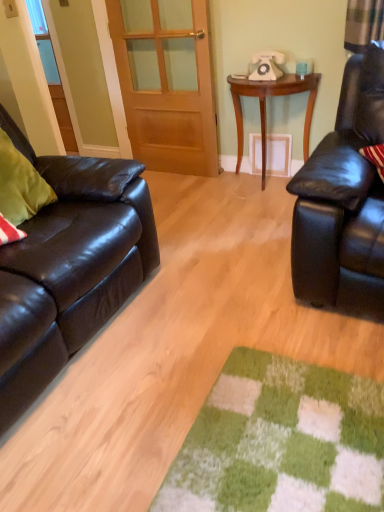
Question: Would you say wooden table at center is outside matte black leather couch at left?

Choices:
 (A) no
 (B) yes

Answer: (B)

Question: Is wooden table at center surrounding matte black leather couch at left?

Choices:
 (A) yes
 (B) no

Answer: (B)

Question: From a real-world perspective, is wooden table at center located beneath matte black leather couch at left?

Choices:
 (A) no
 (B) yes

Answer: (A)

Question: Considering the relative sizes of wooden table at center and matte black leather couch at left in the image provided, is wooden table at center smaller than matte black leather couch at left?

Choices:
 (A) no
 (B) yes

Answer: (B)

Question: Is wooden table at center bigger than matte black leather couch at left?

Choices:
 (A) yes
 (B) no

Answer: (B)

Question: Considering their positions, is white plastic telephone at upper center located in front of or behind shiny black leather couch at left?

Choices:
 (A) front
 (B) behind

Answer: (B)

Question: Is point (256, 56) closer or farther from the camera than point (74, 232)?

Choices:
 (A) farther
 (B) closer

Answer: (A)

Question: Considering the positions of white plastic telephone at upper center and shiny black leather couch at left in the image, is white plastic telephone at upper center taller or shorter than shiny black leather couch at left?

Choices:
 (A) tall
 (B) short

Answer: (B)

Question: Visually, is white plastic telephone at upper center positioned to the left or to the right of shiny black leather couch at left?

Choices:
 (A) left
 (B) right

Answer: (B)

Question: Is point (203, 54) closer or farther from the camera than point (269, 71)?

Choices:
 (A) farther
 (B) closer

Answer: (A)

Question: Considering the positions of wooden door at center and white plastic telephone at upper center in the image, is wooden door at center wider or thinner than white plastic telephone at upper center?

Choices:
 (A) thin
 (B) wide

Answer: (A)

Question: From a real-world perspective, is wooden door at center above or below white plastic telephone at upper center?

Choices:
 (A) above
 (B) below

Answer: (B)

Question: Relative to white plastic telephone at upper center, is wooden door at center in front or behind?

Choices:
 (A) behind
 (B) front

Answer: (A)

Question: Relative to wooden door at center, is shiny black leather couch at left in front or behind?

Choices:
 (A) front
 (B) behind

Answer: (A)

Question: Which is correct: shiny black leather couch at left is inside wooden door at center, or outside of it?

Choices:
 (A) inside
 (B) outside

Answer: (B)